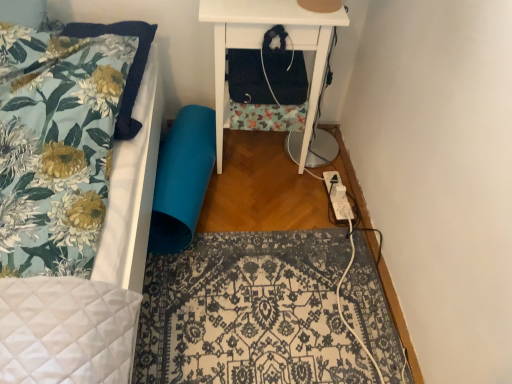
I want to click on empty space that is in between white plastic extension cord at lower right and patterned fabric rug at center, so click(269, 215).